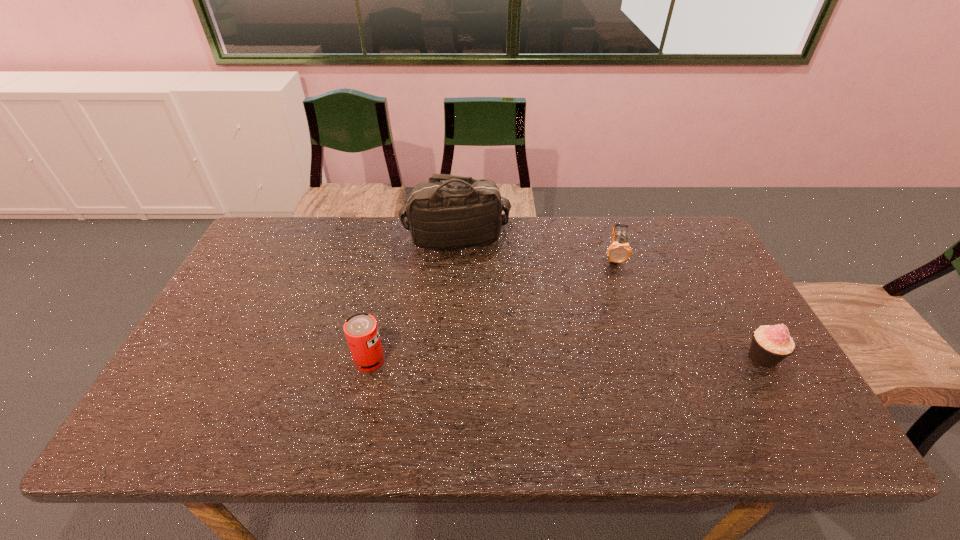
This screenshot has width=960, height=540. I want to click on vacant space on the desktop that is between the can and the rightmost object and is positioned on the face of the second object from right to left, so coord(619,358).

Where is `vacant space on the desktop that is between the can and the rightmost object and is positioned at the front padded panel of the tallest object`? The image size is (960, 540). vacant space on the desktop that is between the can and the rightmost object and is positioned at the front padded panel of the tallest object is located at coordinates (520, 359).